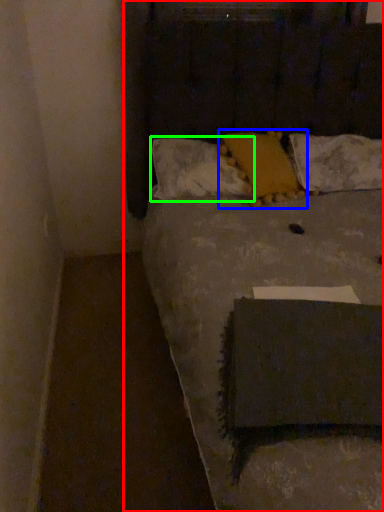
Question: Which object is positioned farthest from bed (highlighted by a red box)? Select from pillow (highlighted by a blue box) and pillow (highlighted by a green box).

Choices:
 (A) pillow
 (B) pillow

Answer: (A)